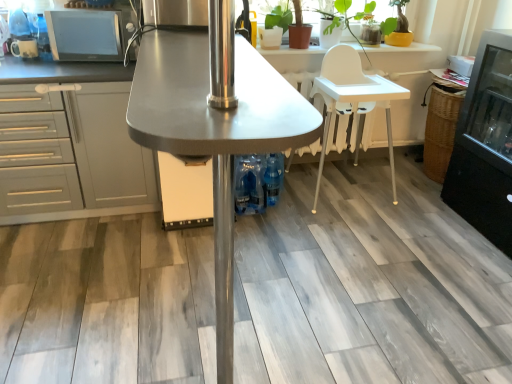
I want to click on vacant area to the right of white plastic chair at center, so click(412, 196).